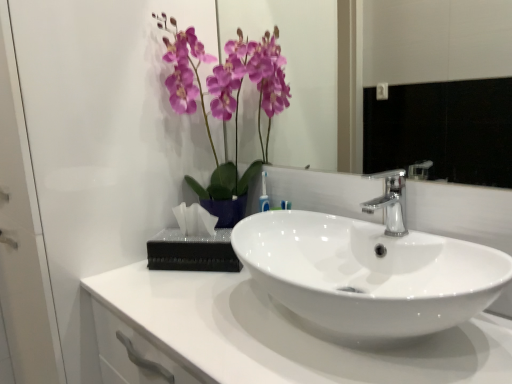
The height and width of the screenshot is (384, 512). In order to click on vacant space situated on the left part of white glossy sink at center in this screenshot , I will do `click(184, 311)`.